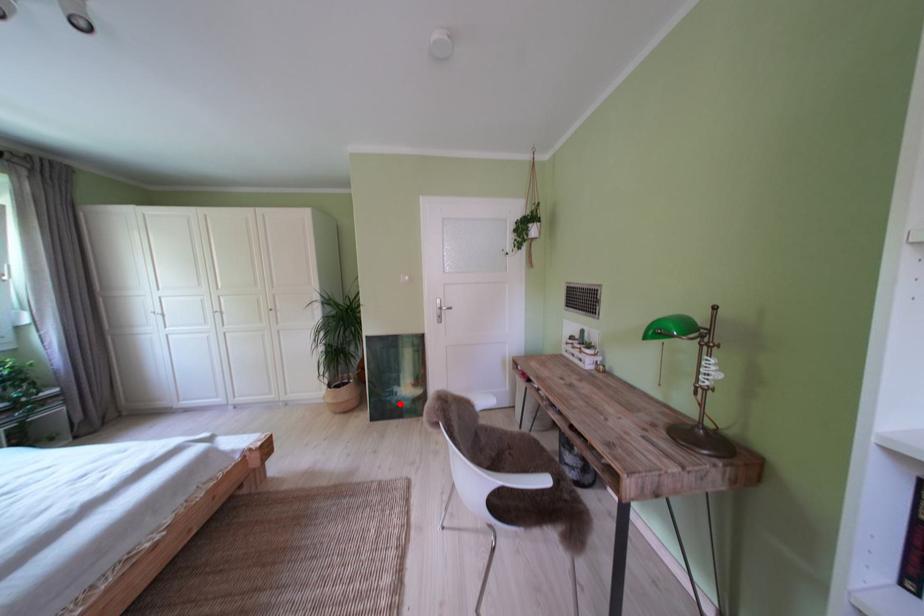
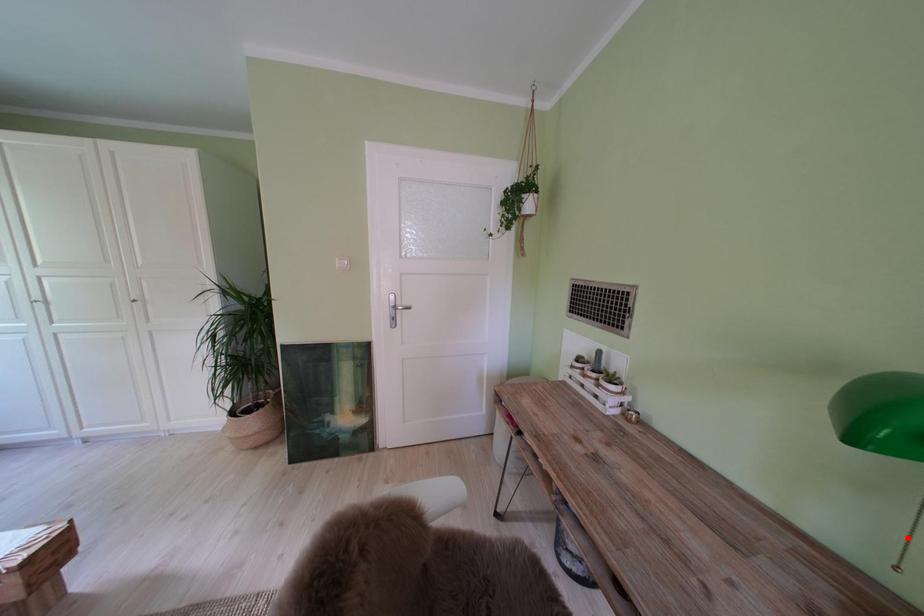
Based on the photo, I am providing you with two images of the same scene from different viewpoints. A red point is marked on the first image and another point is marked on the second image. Is the red point in image1 aligned with the point shown in image2?

No